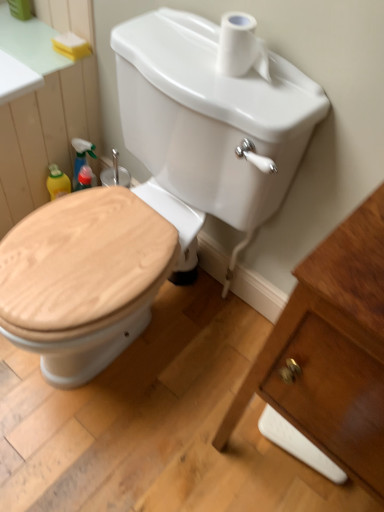
I want to click on vacant area that is situated to the right of white matte toilet paper at upper center, so click(x=294, y=83).